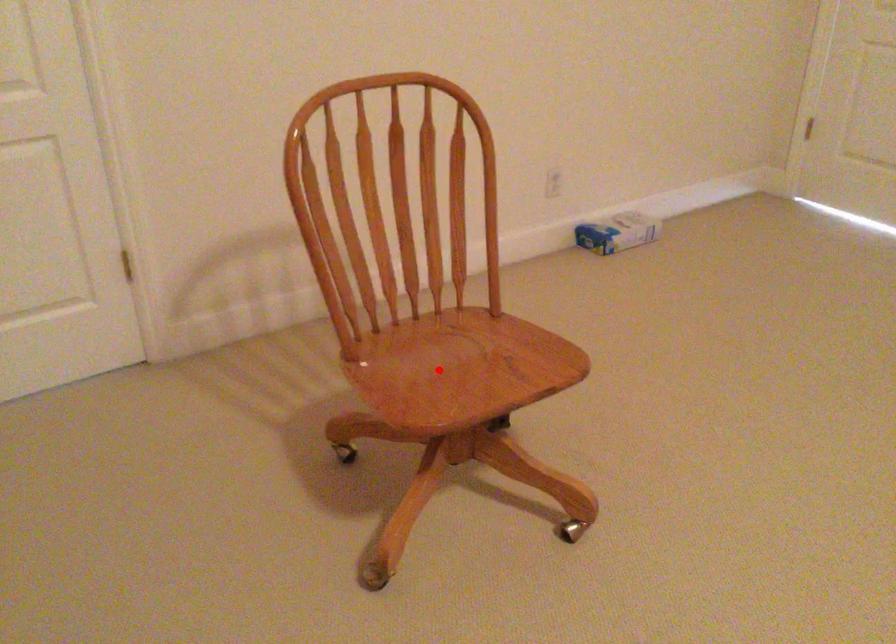
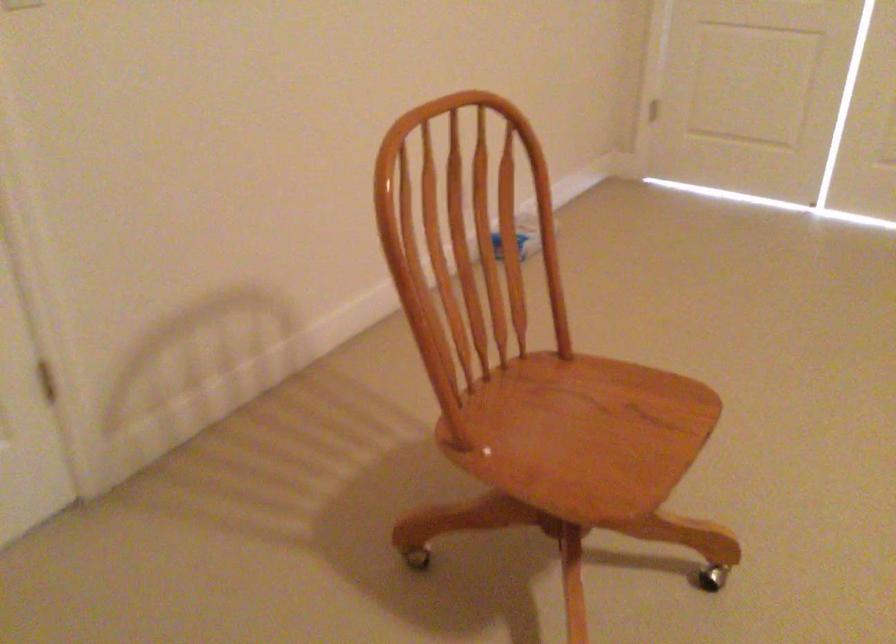
The point at the highlighted location is marked in the first image. Where is the corresponding point in the second image?

(565, 436)